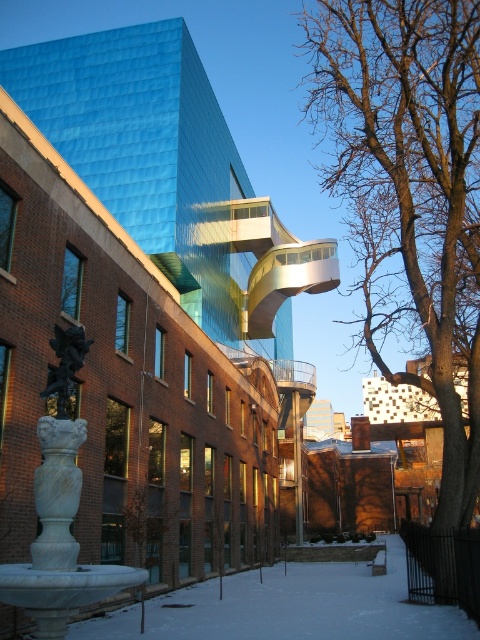
Question: Is bare branches at center above white marble statue at center?

Choices:
 (A) no
 (B) yes

Answer: (B)

Question: Can you confirm if bare branches at center is positioned to the left of black marble statue at lower left?

Choices:
 (A) no
 (B) yes

Answer: (A)

Question: Considering the real-world distances, which object is closest to the white powdery snow at lower center?

Choices:
 (A) bare branches at center
 (B) black marble statue at lower left

Answer: (B)

Question: Is bare branches at center wider than white powdery snow at lower center?

Choices:
 (A) no
 (B) yes

Answer: (B)

Question: Which of the following is the closest to the observer?

Choices:
 (A) (44, 390)
 (B) (49, 534)
 (C) (193, 589)
 (D) (472, 83)

Answer: (B)

Question: Among these points, which one is farthest from the camera?

Choices:
 (A) (64, 497)
 (B) (458, 83)
 (C) (451, 616)
 (D) (76, 336)

Answer: (B)